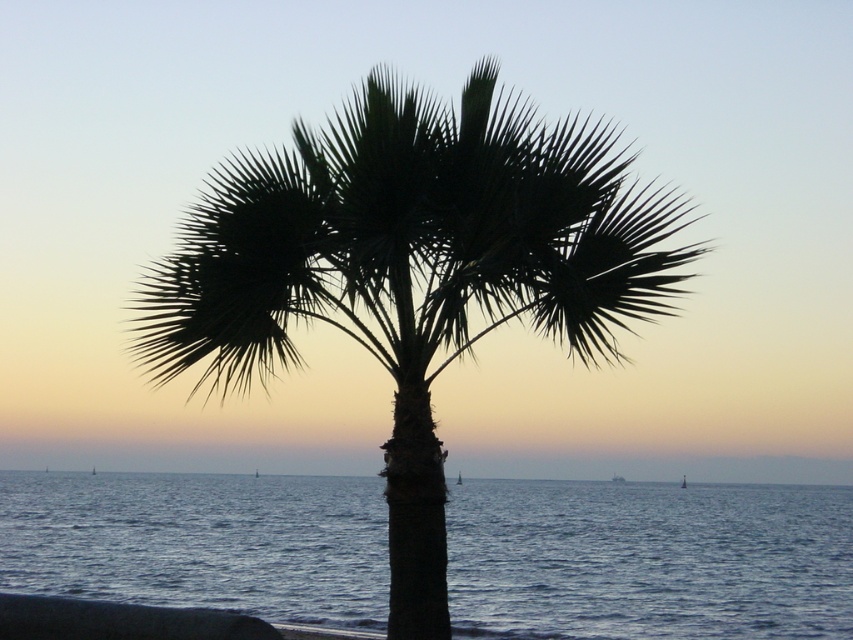
Question: Which point is farther to the camera?

Choices:
 (A) (421, 432)
 (B) (204, 506)

Answer: (B)

Question: Is silhouette leafy palm at center wider than dark blue water at center?

Choices:
 (A) yes
 (B) no

Answer: (B)

Question: Where is silhouette leafy palm at center located in relation to dark blue water at center in the image?

Choices:
 (A) right
 (B) left

Answer: (A)

Question: Which point appears closest to the camera in this image?

Choices:
 (A) (294, 589)
 (B) (436, 509)

Answer: (B)

Question: Is silhouette leafy palm at center above dark blue water at center?

Choices:
 (A) yes
 (B) no

Answer: (A)